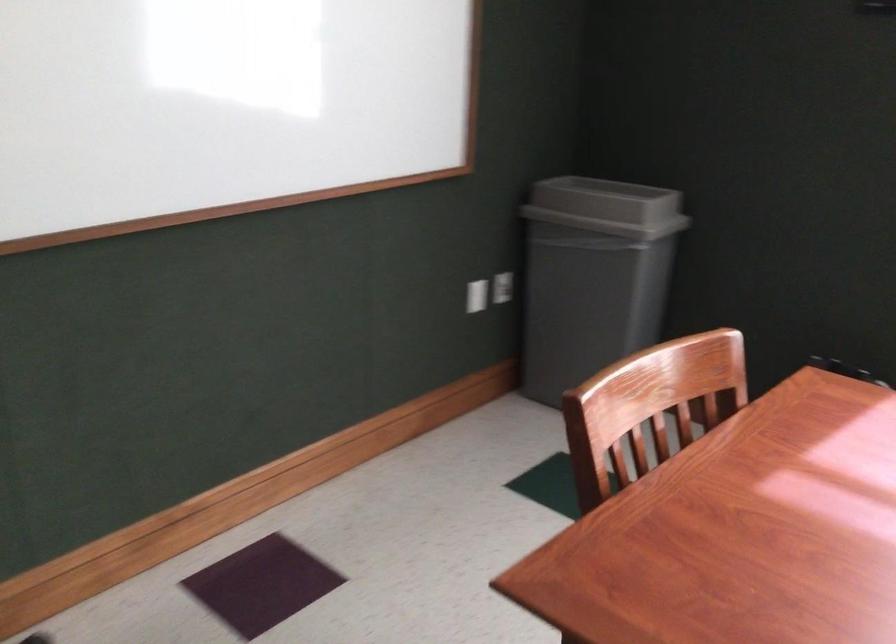
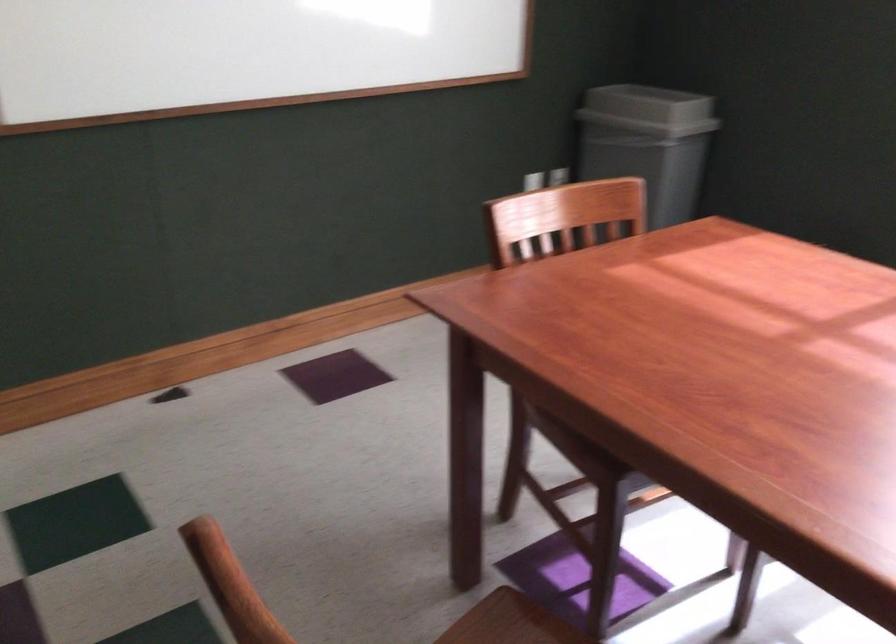
The images are taken continuously from a first-person perspective. In which direction are you moving?

The cameraman moved toward right, backward.